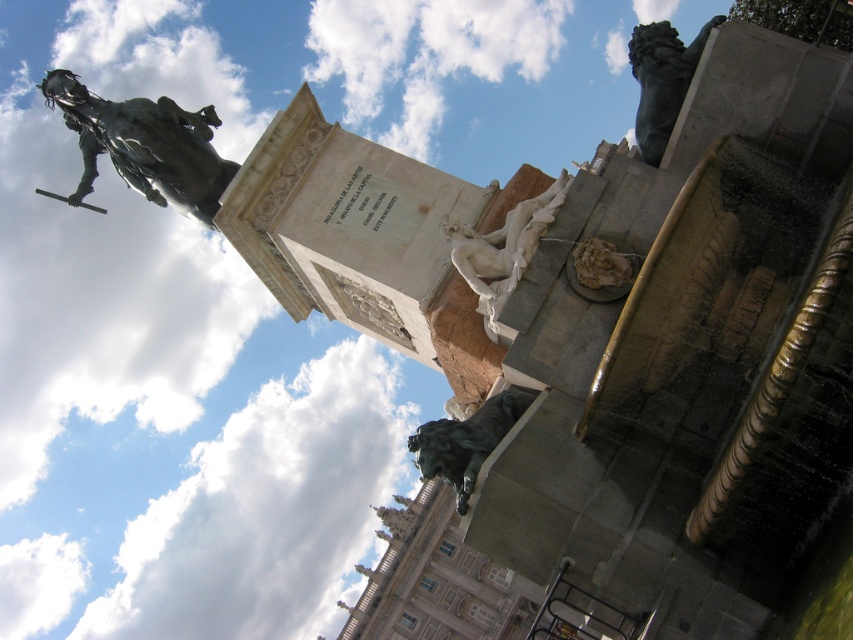
You are standing in front of the monument and want to take a photo of both the bronze statue at upper left and the bronze statue at lower right. Which statue will appear closer to you in the photo?

The bronze statue at upper left will appear closer to you in the photo because it is positioned further to the viewer than the bronze statue at lower right.

You are standing at the base of the monument and want to take a photo that includes both the bronze statue of a figure on horseback holding a sword aloft and the sculpted figure of a reclining woman. From your current position, which of the two points, point (637, 124) or point (428, 422), is closer to you?

Point (428, 422) is closer to you since it is in front of point (637, 124) according to their spatial arrangement.